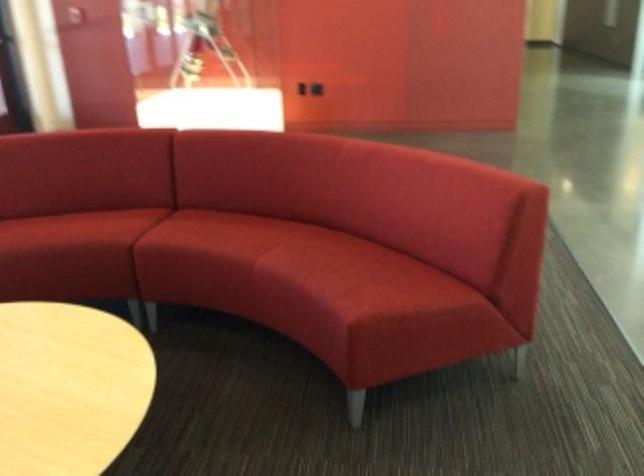
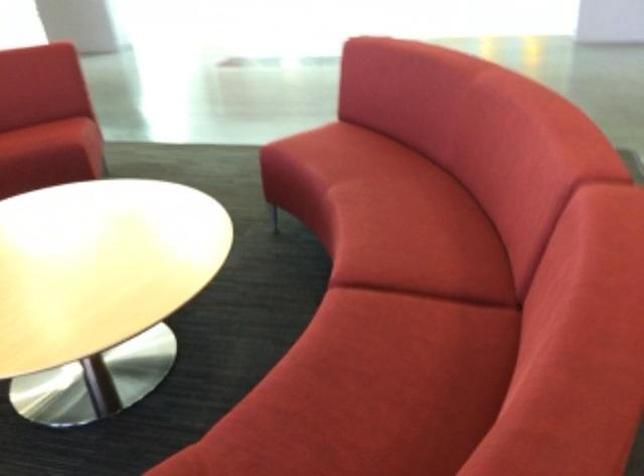
Find the pixel in the second image that matches the point at 363,280 in the first image.

(46, 136)